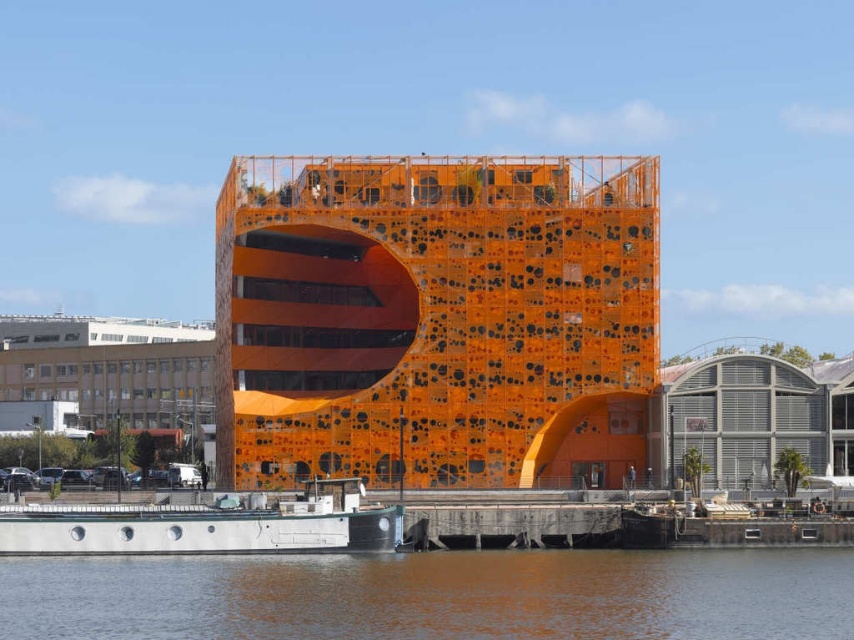
Consider the image. Is brown water at lower center positioned before metallic gray boat at lower left?

Yes.

Locate an element on the screen. brown water at lower center is located at coordinates (436, 595).

From the picture: Can you confirm if orange perforated metal building at center is positioned above brown water at lower center?

Indeed, orange perforated metal building at center is positioned over brown water at lower center.

From the picture: Does orange perforated metal building at center have a larger size compared to brown water at lower center?

Yes.

This screenshot has height=640, width=854. Describe the element at coordinates (436, 320) in the screenshot. I see `orange perforated metal building at center` at that location.

Where is `orange perforated metal building at center`? orange perforated metal building at center is located at coordinates (x=436, y=320).

Between orange perforated metal building at center and metallic gray warehouse at right, which one has more height?

Standing taller between the two is orange perforated metal building at center.

Can you confirm if orange perforated metal building at center is positioned below metallic gray warehouse at right?

Incorrect, orange perforated metal building at center is not positioned below metallic gray warehouse at right.

Who is more forward, (574,296) or (771,432)?

Point (771,432) is in front.

This screenshot has width=854, height=640. I want to click on orange perforated metal building at center, so click(436, 320).